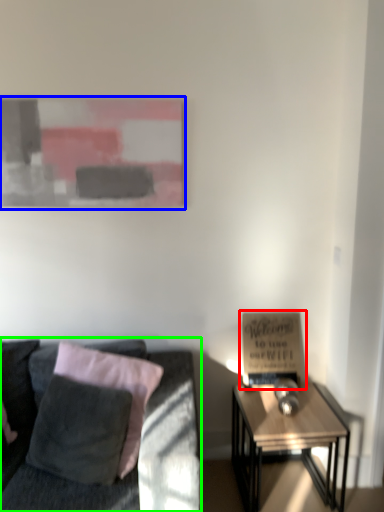
Question: Based on their relative distances, which object is nearer to bulletin board (highlighted by a red box)? Choose from picture frame (highlighted by a blue box) and studio couch (highlighted by a green box).

Choices:
 (A) picture frame
 (B) studio couch

Answer: (B)